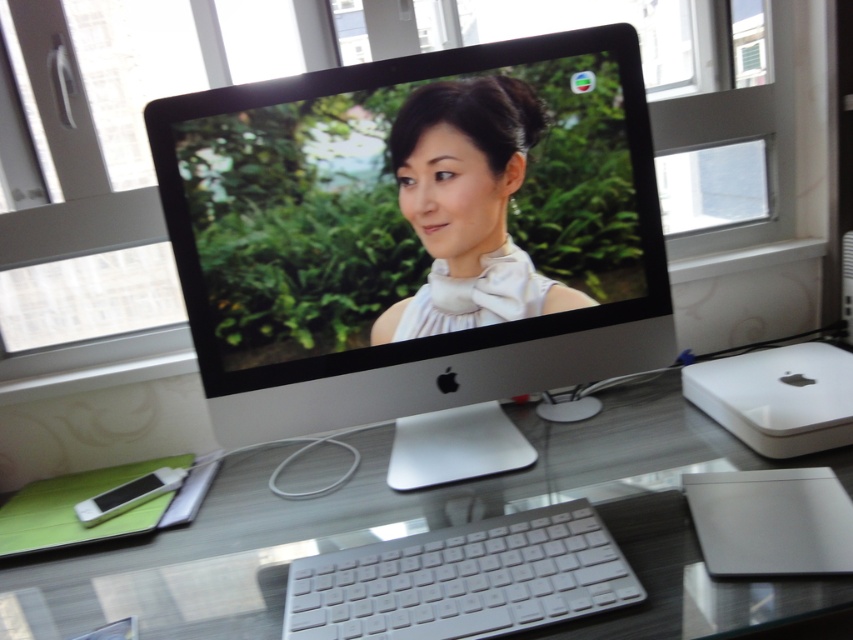
You are a delivery person who needs to place a fragile package on the desk without obstructing the view of the iMac monitor. The package will be placed at point (432, 529). Will the package be on a transparent surface?

Yes, the package will be placed on the transparent glass desk at center, so it won

You are setting up a new computer desk and want to place a mouse between the silver metallic computer monitor at center and the white plastic keyboard at center. If the mouse requires 3 inches of space, will there be enough room?

The silver metallic computer monitor at center is 11.63 inches from the white plastic keyboard at center, so placing a mouse requiring 3 inches of space between them would be sufficient as there is ample space available.

You are standing in front of the workspace and want to reach both points on the desk. Which point, point (619, 122) or point (445, 572), is closer to you?

Point (619, 122) is closer to you because it is further to the viewer than point (445, 572).